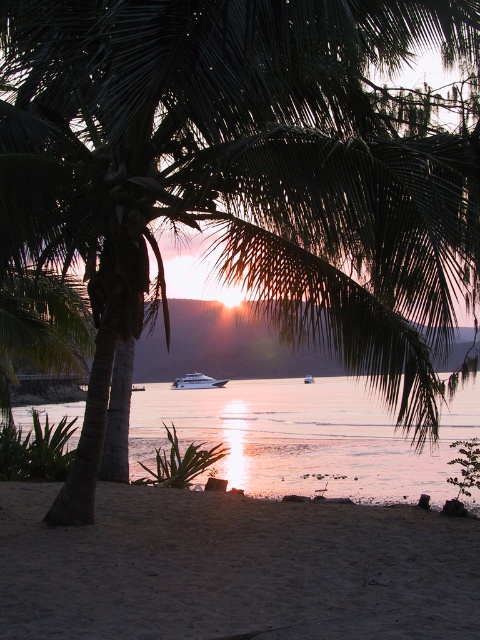
Who is more forward, (315,636) or (180,381)?

Positioned in front is point (315,636).

How far apart are sandy at lower center and white glossy yacht at center?

The distance of sandy at lower center from white glossy yacht at center is 4.96 meters.

Is point (323, 563) less distant than point (180, 381)?

Yes, it is in front of point (180, 381).

Locate an element on the screen. The height and width of the screenshot is (640, 480). sandy at lower center is located at coordinates (233, 568).

Is sandy at lower center to the left of glistening silver water at center from the viewer's perspective?

Yes, sandy at lower center is to the left of glistening silver water at center.

Based on the photo, between sandy at lower center and glistening silver water at center, which one is positioned lower?

sandy at lower center is lower down.

The image size is (480, 640). What are the coordinates of `sandy at lower center` in the screenshot? It's located at (233, 568).

Does glistening silver water at center appear on the left side of white glossy yacht at center?

In fact, glistening silver water at center is to the right of white glossy yacht at center.

Does glistening silver water at center come in front of white glossy yacht at center?

That is True.

Does point (331, 476) lie behind point (200, 385)?

That is False.

In order to click on glistening silver water at center in this screenshot , I will do `click(305, 436)`.